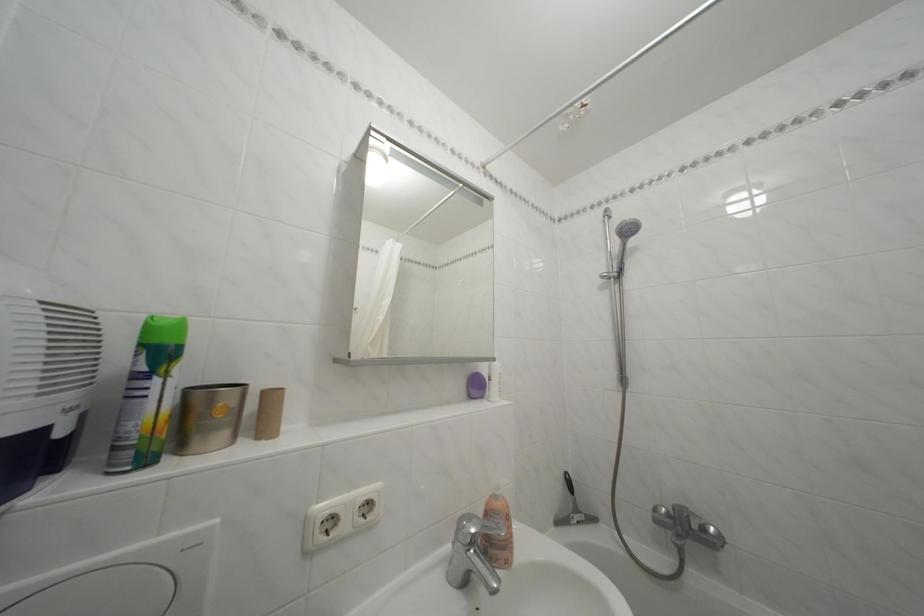
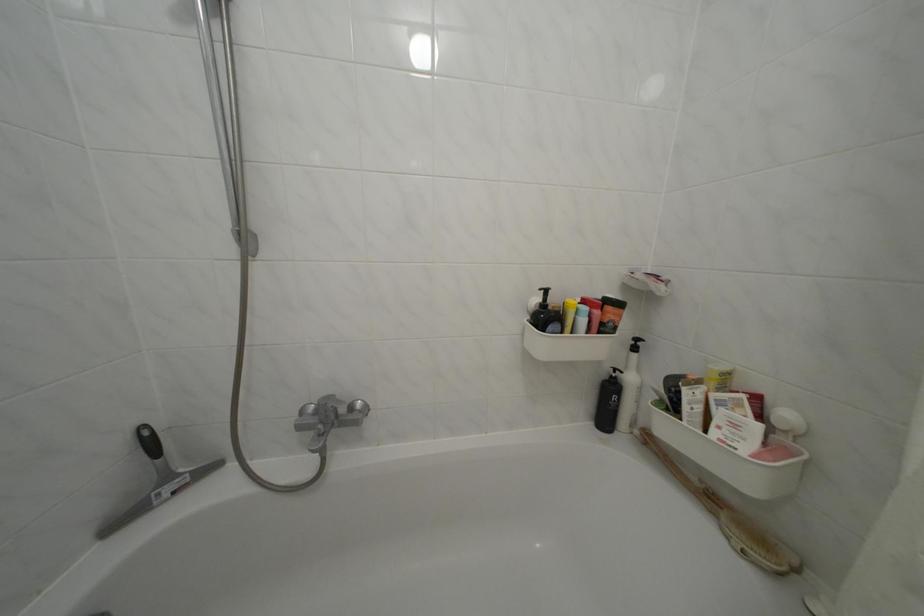
Locate, in the second image, the point that corresponds to (x=586, y=517) in the first image.

(176, 484)